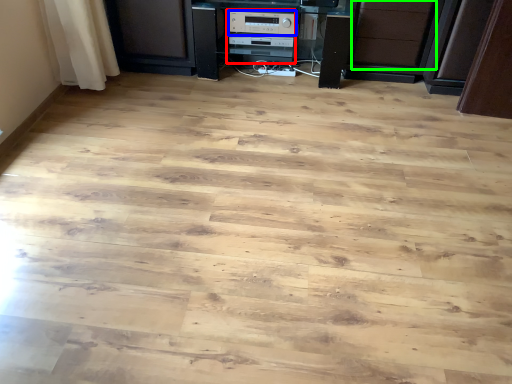
Question: Considering the real-world distances, which object is farthest from appliance (highlighted by a red box)? appliance (highlighted by a blue box) or drawer (highlighted by a green box)?

Choices:
 (A) appliance
 (B) drawer

Answer: (B)